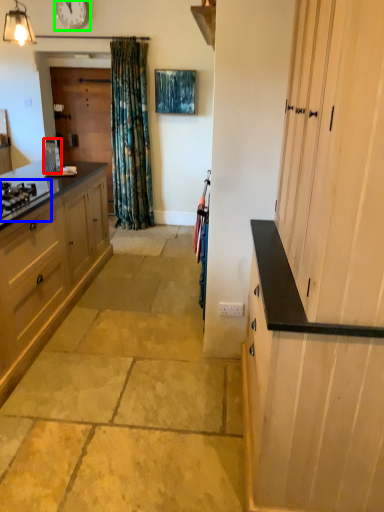
Question: Which is farther away from appliance (highlighted by a red box)? gas stove (highlighted by a blue box) or clock (highlighted by a green box)?

Choices:
 (A) gas stove
 (B) clock

Answer: (B)